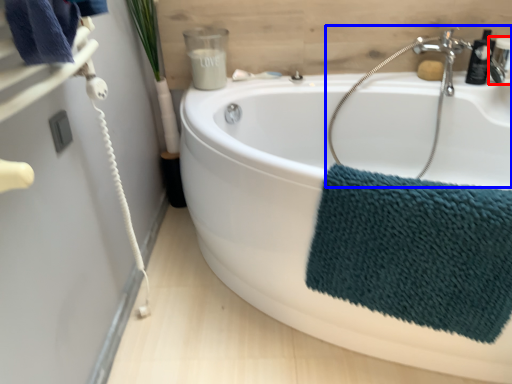
Question: Among these objects, which one is nearest to the camera, plumbing fixture (highlighted by a red box) or sink (highlighted by a blue box)?

Choices:
 (A) plumbing fixture
 (B) sink

Answer: (B)